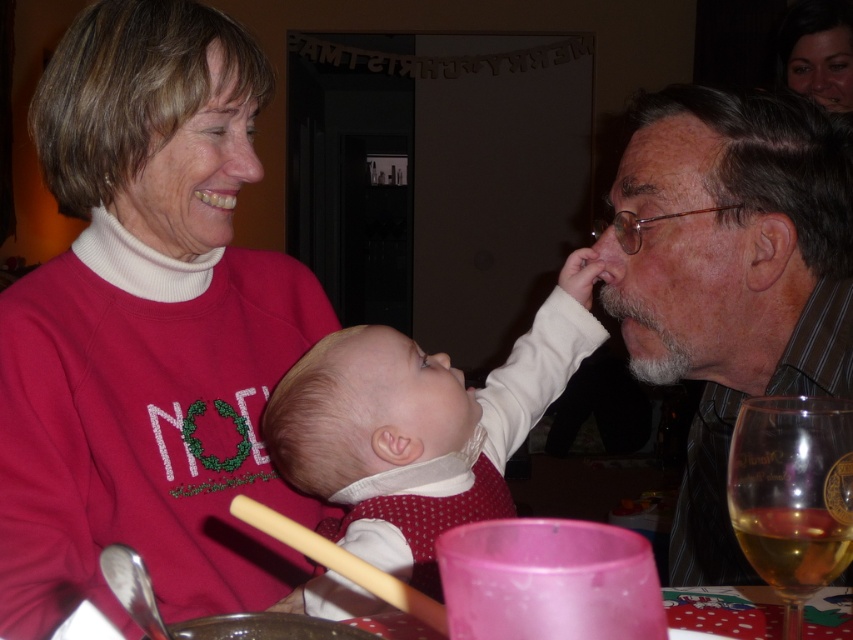
Between transparent glass at lower right and wooden chopstick at lower center, which one appears on the left side from the viewer's perspective?

wooden chopstick at lower center

Who is lower down, transparent glass at lower right or wooden chopstick at lower center?

wooden chopstick at lower center is lower down.

Find the location of `transparent glass at lower right`. transparent glass at lower right is located at coordinates (792, 493).

Locate an element on the screen. Image resolution: width=853 pixels, height=640 pixels. transparent glass at lower right is located at coordinates (792, 493).

Between smooth skin face at upper right and wooden chopstick at lower center, which one appears on the left side from the viewer's perspective?

From the viewer's perspective, wooden chopstick at lower center appears more on the left side.

From the picture: Measure the distance between point (828, 76) and camera.

The distance of point (828, 76) from camera is 7.43 feet.

You are a GUI agent. You are given a task and a screenshot of the screen. Output one action in this format:
    pyautogui.click(x=<x>, y=<y>)
    Task: Click on the smooth skin face at upper right
    Image resolution: width=853 pixels, height=640 pixels.
    Given the screenshot: What is the action you would take?
    pyautogui.click(x=817, y=51)

Does white soft baby at center have a lesser height compared to transparent glass at lower right?

No.

Is white soft baby at center below transparent glass at lower right?

No.

Locate an element on the screen. The image size is (853, 640). white soft baby at center is located at coordinates (421, 424).